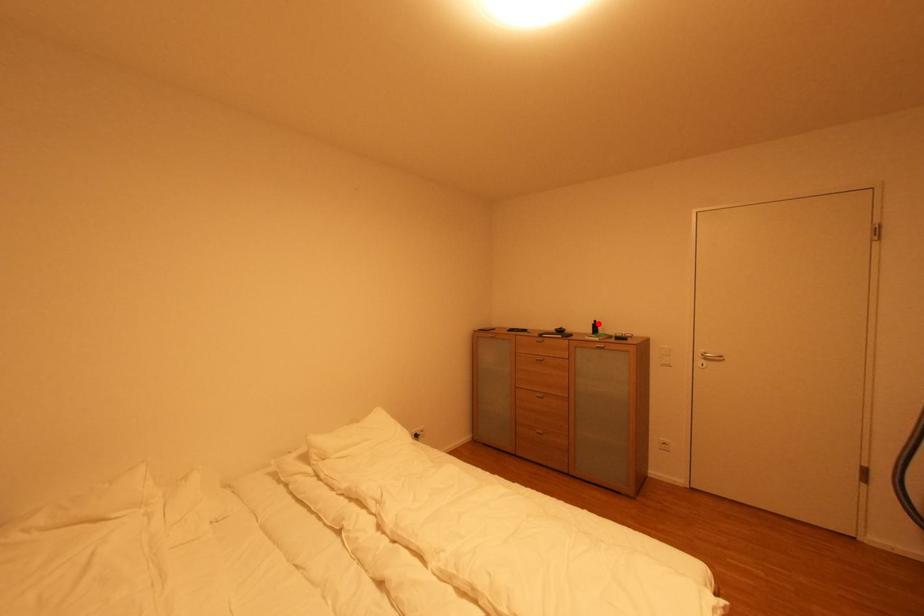
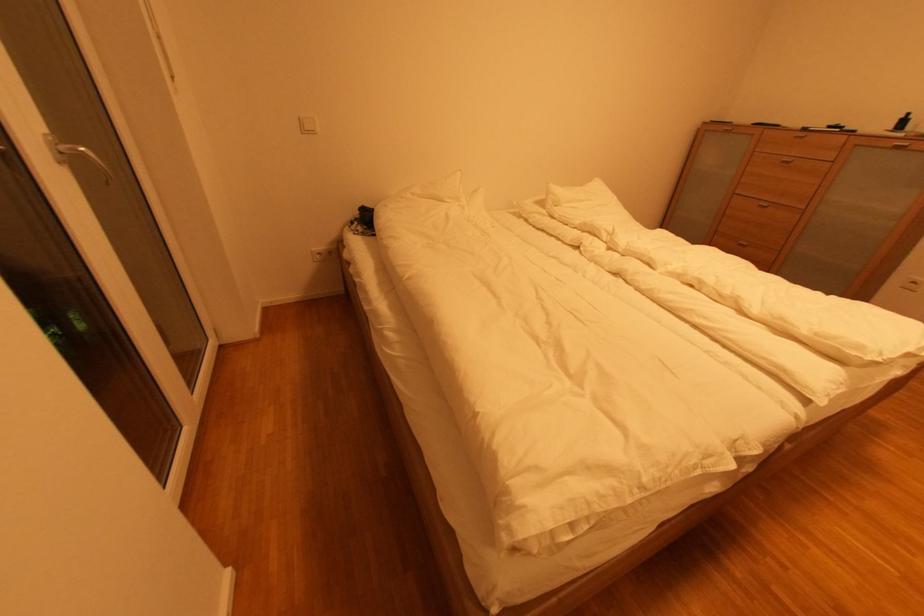
Find the pixel in the second image that matches the highlighted location in the first image.

(908, 118)